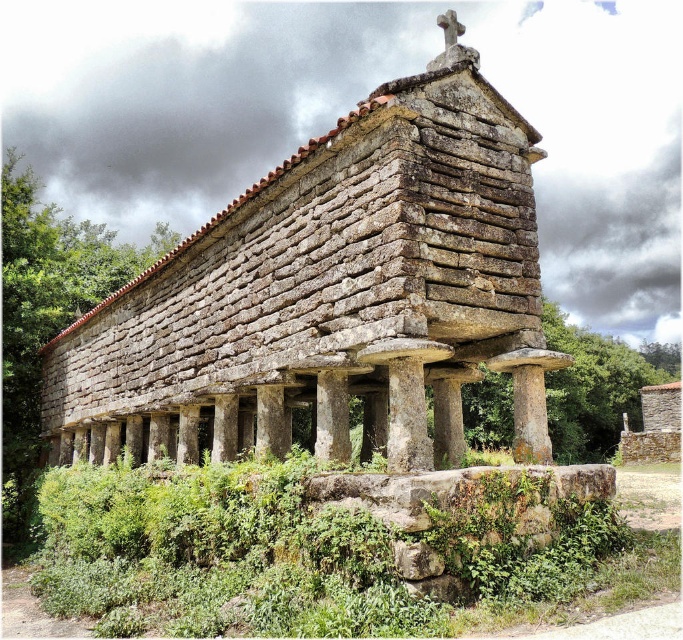
Can you confirm if brown stone hut at center is positioned to the left of gray stone column at center?

Correct, you'll find brown stone hut at center to the left of gray stone column at center.

Who is positioned more to the left, brown stone hut at center or gray stone column at center?

brown stone hut at center

In order to click on brown stone hut at center in this screenshot , I will do `click(333, 291)`.

Does brown stone hut at center have a larger size compared to gray stone pillar at center?

Correct, brown stone hut at center is larger in size than gray stone pillar at center.

Locate an element on the screen. The width and height of the screenshot is (683, 640). brown stone hut at center is located at coordinates (333, 291).

What do you see at coordinates (333, 291) in the screenshot?
I see `brown stone hut at center` at bounding box center [333, 291].

Find the location of a particular element. The height and width of the screenshot is (640, 683). brown stone hut at center is located at coordinates (333, 291).

Between brown stone hut at center and green mossy stone at lower center, which one appears on the right side from the viewer's perspective?

Positioned to the right is brown stone hut at center.

Is point (531, 205) positioned in front of point (184, 499)?

Yes, it is in front of point (184, 499).

Identify the location of brown stone hut at center. Image resolution: width=683 pixels, height=640 pixels. (333, 291).

This screenshot has height=640, width=683. Identify the location of brown stone hut at center. click(333, 291).